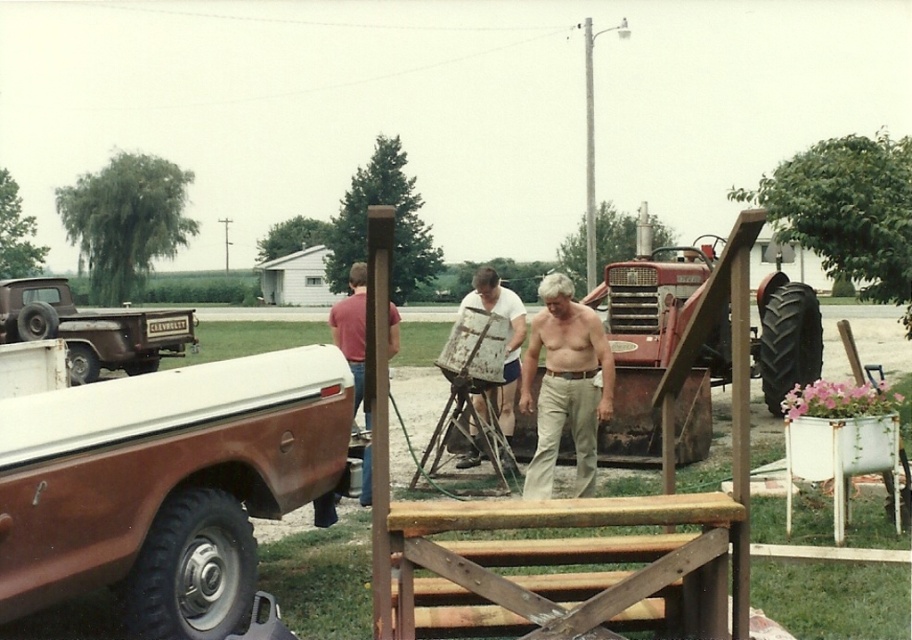
Question: Is rusty brown truck at left to the left of brown wooden bench at center from the viewer's perspective?

Choices:
 (A) no
 (B) yes

Answer: (B)

Question: Does beige cotton pants at center have a greater width compared to matte red shirt at center?

Choices:
 (A) yes
 (B) no

Answer: (B)

Question: Which object is the farthest from the rusty metal truck at left?

Choices:
 (A) rusty brown truck at left
 (B) matte red shirt at center
 (C) brown wooden bench at center
 (D) red metal tractor at center

Answer: (C)

Question: Based on their relative distances, which object is farther from the brown wooden bench at center?

Choices:
 (A) matte red shirt at center
 (B) red metal tractor at center
 (C) white paper bag at center
 (D) rusty metal truck at left

Answer: (D)

Question: Considering the real-world distances, which object is closest to the rusty brown truck at left?

Choices:
 (A) white paper bag at center
 (B) red metal tractor at center
 (C) matte red shirt at center

Answer: (C)

Question: Does brown wooden bench at center have a smaller size compared to matte red shirt at center?

Choices:
 (A) no
 (B) yes

Answer: (B)